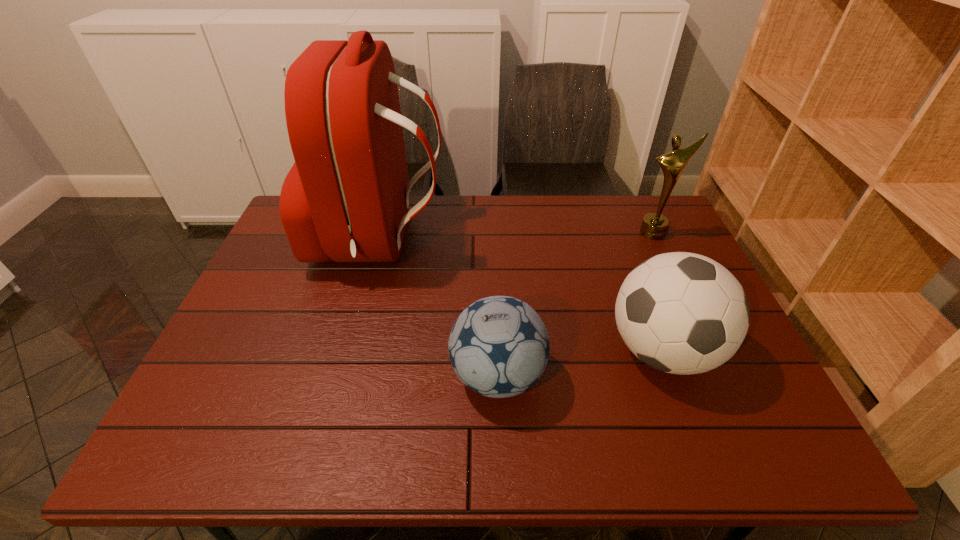
At what (x,y) coordinates should I click in order to perform the action: click on free space located 0.340m on the side with brand of the shortest object. Please return your answer as a coordinate pair (x, y). The image size is (960, 540). Looking at the image, I should click on (301, 376).

You are a GUI agent. You are given a task and a screenshot of the screen. Output one action in this format:
    pyautogui.click(x=<x>, y=<y>)
    Task: Click on the vacant space situated on the side with brand of the shortest object
    This screenshot has width=960, height=540.
    Given the screenshot: What is the action you would take?
    pyautogui.click(x=398, y=376)

Where is `free space located 0.170m on the side with brand of the shortest object`? The width and height of the screenshot is (960, 540). free space located 0.170m on the side with brand of the shortest object is located at coordinates (376, 376).

You are a GUI agent. You are given a task and a screenshot of the screen. Output one action in this format:
    pyautogui.click(x=<x>, y=<y>)
    Task: Click on the backpack located in the far edge section of the desktop
    This screenshot has width=960, height=540.
    Given the screenshot: What is the action you would take?
    pyautogui.click(x=346, y=198)

This screenshot has width=960, height=540. I want to click on award that is at the far edge, so click(654, 226).

At what (x,y) coordinates should I click in order to perform the action: click on object positioned at the left edge. Please return your answer as a coordinate pair (x, y). The width and height of the screenshot is (960, 540). Looking at the image, I should click on (346, 198).

Image resolution: width=960 pixels, height=540 pixels. In order to click on award that is at the right edge in this screenshot , I will do point(654,226).

This screenshot has height=540, width=960. In order to click on soccer ball that is at the right edge in this screenshot , I will do `click(683, 313)`.

You are a GUI agent. You are given a task and a screenshot of the screen. Output one action in this format:
    pyautogui.click(x=<x>, y=<y>)
    Task: Click on the object that is at the far left corner
    This screenshot has height=540, width=960.
    Given the screenshot: What is the action you would take?
    pyautogui.click(x=346, y=198)

Where is `object positioned at the far right corner`? object positioned at the far right corner is located at coordinates (654, 226).